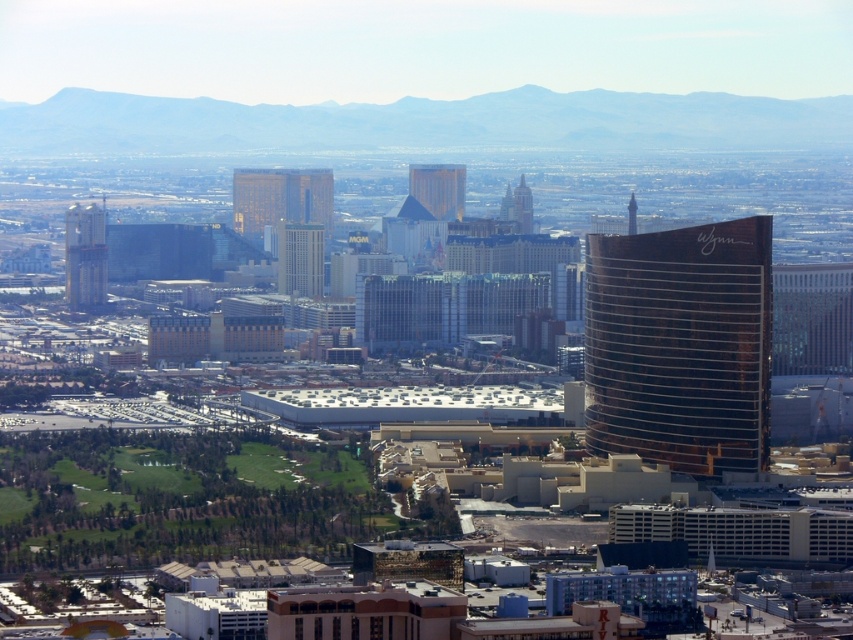
You are standing at the coordinates 0.0, 0.0 in this cityscape. You want to walk directly towards the glassy reflective skyscraper at center. Which direction should you head?

Since the glassy reflective skyscraper at center is located at coordinates point (300, 259), you should head northeast to reach it from your current position at (0, 0).

You are a tourist in Las Vegas and want to take a photo that captures both the glassy reflective skyscraper at center and the gold glass tower at center. Which one will appear taller in your photo?

The glassy reflective skyscraper at center will appear taller in the photo because it is taller than the gold glass tower at center.

You are a drone operator who needs to deliver a package to a gold reflective tower at left. The maximum distance your drone can travel is 600 meters. Based on the scene, can your drone reach the tower?

The gold reflective tower at left is 661.52 meters from camera, which exceeds the drone maximum distance of 600 meters. Therefore, the drone cannot reach the tower.